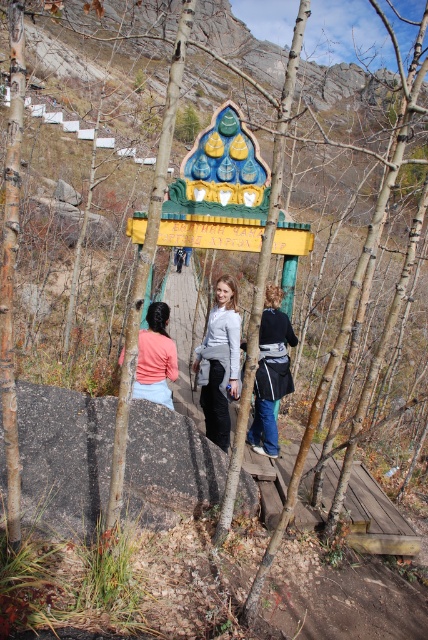
Does point (148, 452) come farther from viewer compared to point (184, 394)?

No, it is in front of (184, 394).

Find the location of a particular element. Image resolution: width=428 pixels, height=640 pixels. gray rough rock at lower left is located at coordinates (64, 458).

In order to click on gray rough rock at lower left in this screenshot , I will do `click(64, 458)`.

Who is shorter, dark gray fabric jacket at center or matte pink sweater at center?

Standing shorter between the two is matte pink sweater at center.

Can you confirm if dark gray fabric jacket at center is positioned above matte pink sweater at center?

No, dark gray fabric jacket at center is not above matte pink sweater at center.

Where is `dark gray fabric jacket at center`? This screenshot has height=640, width=428. dark gray fabric jacket at center is located at coordinates (270, 372).

Is matte gray sweater at center bigger than matte pink fabric at center?

No, matte gray sweater at center is not bigger than matte pink fabric at center.

Is matte gray sweater at center wider than matte pink fabric at center?

In fact, matte gray sweater at center might be narrower than matte pink fabric at center.

Is point (216, 349) farther from camera compared to point (168, 301)?

No, (216, 349) is closer to viewer.

The height and width of the screenshot is (640, 428). In order to click on matte gray sweater at center in this screenshot , I will do [220, 362].